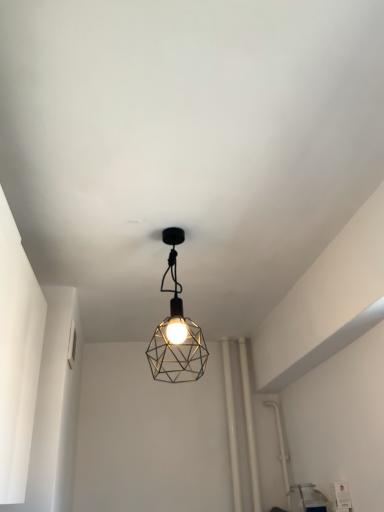
In order to click on metallic wireframe lamp at center in this screenshot , I will do `click(176, 331)`.

What do you see at coordinates (176, 331) in the screenshot? The width and height of the screenshot is (384, 512). I see `metallic wireframe lamp at center` at bounding box center [176, 331].

What are the coordinates of `metallic wireframe lamp at center` in the screenshot? It's located at (176, 331).